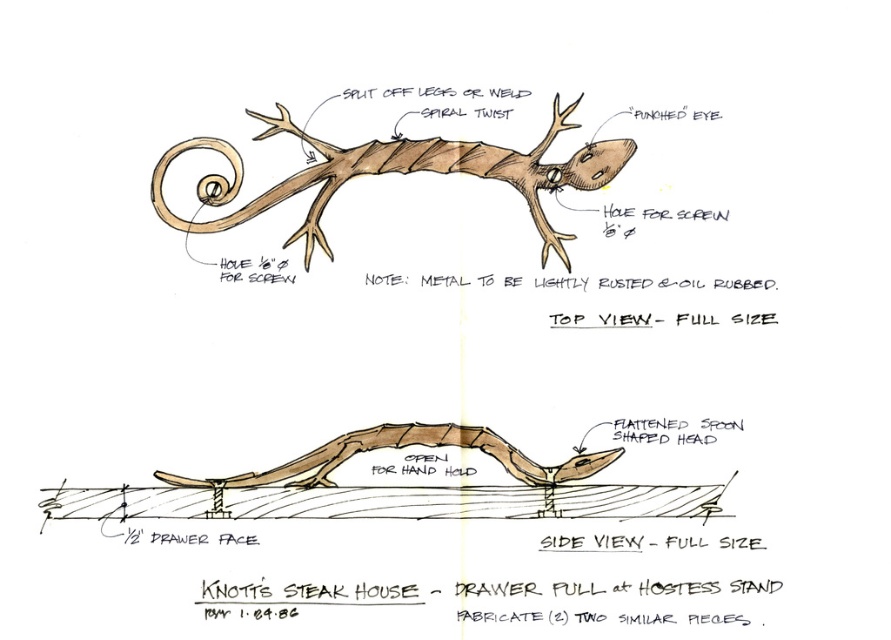
Who is higher up, rustic metal lizard at center or brown matte wood lizard at center?

rustic metal lizard at center is higher up.

Is rustic metal lizard at center positioned at the back of brown matte wood lizard at center?

That is True.

Who is more forward, (479, 161) or (329, 472)?

Positioned in front is point (329, 472).

Locate an element on the screen. The width and height of the screenshot is (891, 640). rustic metal lizard at center is located at coordinates (395, 172).